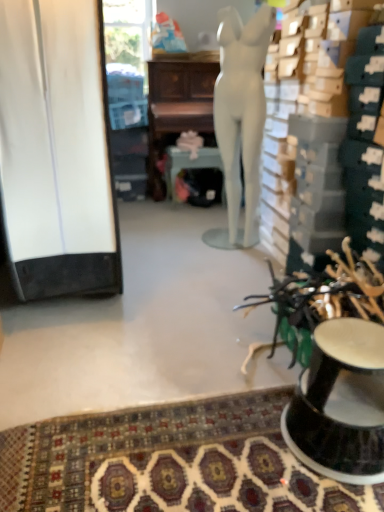
This screenshot has width=384, height=512. Identify the location of vacant space that is in between white matte mannequin at center and white matte cabinet at left. (165, 262).